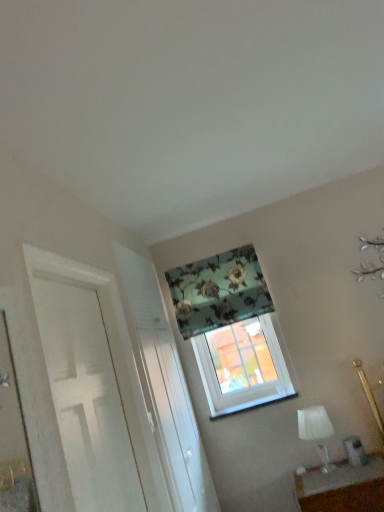
Question: Looking at the image, does white textured screen door at center seem bigger or smaller compared to matte white table at lower right?

Choices:
 (A) small
 (B) big

Answer: (B)

Question: From a real-world perspective, relative to matte white table at lower right, is white textured screen door at center vertically above or below?

Choices:
 (A) above
 (B) below

Answer: (A)

Question: Considering the real-world distances, which object is closest to the white plastic window sill at center?

Choices:
 (A) matte white table at lower right
 (B) white painted wood door at left
 (C) white glass table lamp at lower right
 (D) floral fabric curtain at upper center
 (E) translucent glass window at center

Answer: (C)

Question: Which of these objects is positioned closest to the translucent glass window at center?

Choices:
 (A) white glass table lamp at lower right
 (B) white textured screen door at center
 (C) white painted wood door at left
 (D) floral fabric curtain at upper center
 (E) white plastic window sill at center

Answer: (E)